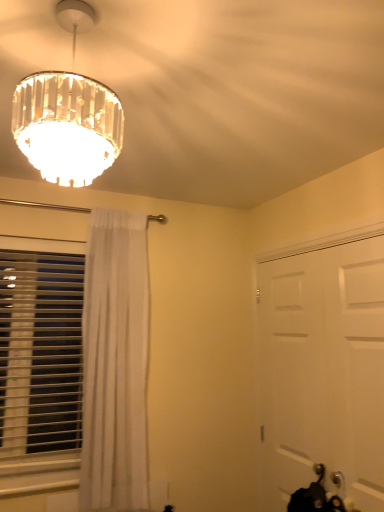
Question: Is clear crystal chandelier at upper left smaller than white sheer curtain at left?

Choices:
 (A) yes
 (B) no

Answer: (B)

Question: Would you say clear crystal chandelier at upper left is outside white sheer curtain at left?

Choices:
 (A) no
 (B) yes

Answer: (B)

Question: Does clear crystal chandelier at upper left lie behind white sheer curtain at left?

Choices:
 (A) no
 (B) yes

Answer: (A)

Question: Is clear crystal chandelier at upper left closer to camera compared to white sheer curtain at left?

Choices:
 (A) yes
 (B) no

Answer: (A)

Question: Is clear crystal chandelier at upper left placed right next to white sheer curtain at left?

Choices:
 (A) no
 (B) yes

Answer: (A)

Question: Which is correct: white matte door at right is inside white plastic blinds at left, or outside of it?

Choices:
 (A) outside
 (B) inside

Answer: (A)

Question: Is point (281, 296) positioned closer to the camera than point (6, 403)?

Choices:
 (A) closer
 (B) farther

Answer: (B)

Question: From the image's perspective, is white matte door at right located above or below white plastic blinds at left?

Choices:
 (A) above
 (B) below

Answer: (B)

Question: Considering the positions of white matte door at right and white plastic blinds at left in the image, is white matte door at right bigger or smaller than white plastic blinds at left?

Choices:
 (A) big
 (B) small

Answer: (A)

Question: From the image's perspective, is white sheer curtain at left positioned above or below white plastic blinds at left?

Choices:
 (A) above
 (B) below

Answer: (A)

Question: Would you say white sheer curtain at left is to the left or to the right of white plastic blinds at left in the picture?

Choices:
 (A) left
 (B) right

Answer: (B)

Question: Looking at their shapes, would you say white sheer curtain at left is wider or thinner than white plastic blinds at left?

Choices:
 (A) thin
 (B) wide

Answer: (B)

Question: Considering the positions of point (99, 262) and point (16, 334), is point (99, 262) closer or farther from the camera than point (16, 334)?

Choices:
 (A) closer
 (B) farther

Answer: (A)

Question: Looking at their shapes, would you say white plastic blinds at left is wider or thinner than clear crystal chandelier at upper left?

Choices:
 (A) thin
 (B) wide

Answer: (A)

Question: Visually, is white plastic blinds at left positioned to the left or to the right of clear crystal chandelier at upper left?

Choices:
 (A) right
 (B) left

Answer: (B)